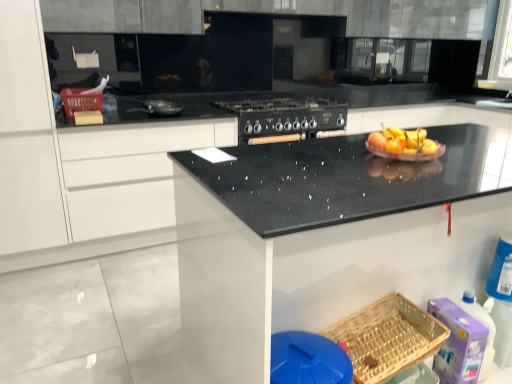
Question: From the image's perspective, does matte plastic basket at upper left, which is counted as the 1th basket, starting from the top, appear lower than black speckled granite at center?

Choices:
 (A) no
 (B) yes

Answer: (A)

Question: Is matte plastic basket at upper left, the second basket in the front-to-back sequence, facing towards black speckled granite at center?

Choices:
 (A) yes
 (B) no

Answer: (B)

Question: Is matte plastic basket at upper left, arranged as the first basket when viewed from the left, further to the viewer compared to black speckled granite at center?

Choices:
 (A) yes
 (B) no

Answer: (A)

Question: From the image's perspective, is matte plastic basket at upper left, the second basket in the front-to-back sequence, above black speckled granite at center?

Choices:
 (A) yes
 (B) no

Answer: (A)

Question: Is black speckled granite at center located within matte plastic basket at upper left, the second basket in the front-to-back sequence?

Choices:
 (A) yes
 (B) no

Answer: (B)

Question: Is matte plastic basket at upper left, which is counted as the 1th basket, starting from the top, closer to the viewer compared to black speckled granite at center?

Choices:
 (A) no
 (B) yes

Answer: (A)

Question: Is black speckled granite at center located outside woven wood basket at lower right, which is the second basket from left to right?

Choices:
 (A) no
 (B) yes

Answer: (B)

Question: Considering the relative positions of black speckled granite at center and woven wood basket at lower right, the 1th basket from the bottom, in the image provided, is black speckled granite at center to the right of woven wood basket at lower right, the 1th basket from the bottom, from the viewer's perspective?

Choices:
 (A) yes
 (B) no

Answer: (A)

Question: Considering the relative sizes of black speckled granite at center and woven wood basket at lower right, acting as the first basket starting from the front, in the image provided, is black speckled granite at center wider than woven wood basket at lower right, acting as the first basket starting from the front,?

Choices:
 (A) no
 (B) yes

Answer: (B)

Question: Can you confirm if black speckled granite at center is shorter than woven wood basket at lower right, the 1th basket when ordered from right to left?

Choices:
 (A) no
 (B) yes

Answer: (A)

Question: Can woven wood basket at lower right, the 1th basket from the bottom, be found inside black speckled granite at center?

Choices:
 (A) yes
 (B) no

Answer: (A)

Question: Can you confirm if black speckled granite at center is thinner than woven wood basket at lower right, arranged as the second basket when viewed from the top?

Choices:
 (A) yes
 (B) no

Answer: (B)

Question: Can you confirm if black speckled granite at center is taller than shiny silver frying pan at center, which ranks as the 1th appliance in front-to-back order?

Choices:
 (A) no
 (B) yes

Answer: (B)